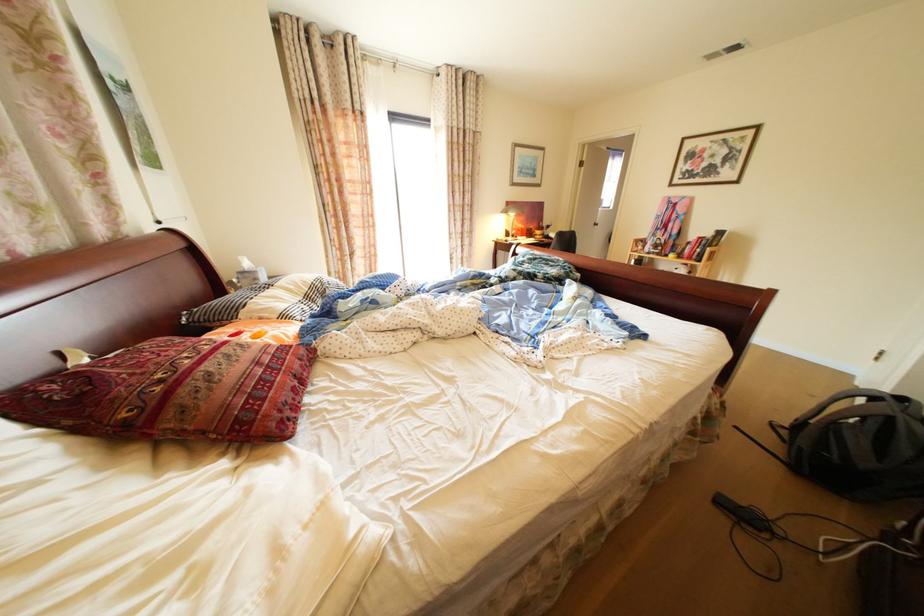
The location [508,217] corresponds to which object?

It corresponds to the orange table lamp in the image.